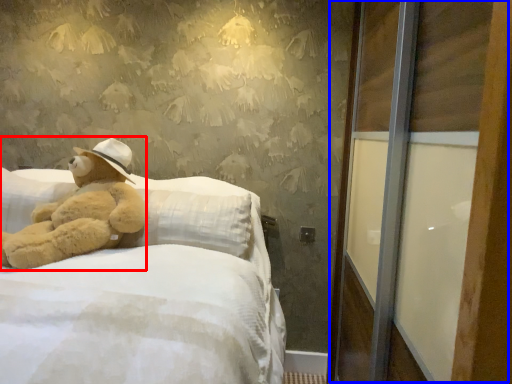
Question: Which object appears closest to the camera in this image, teddy bear (highlighted by a red box) or screen door (highlighted by a blue box)?

Choices:
 (A) teddy bear
 (B) screen door

Answer: (B)